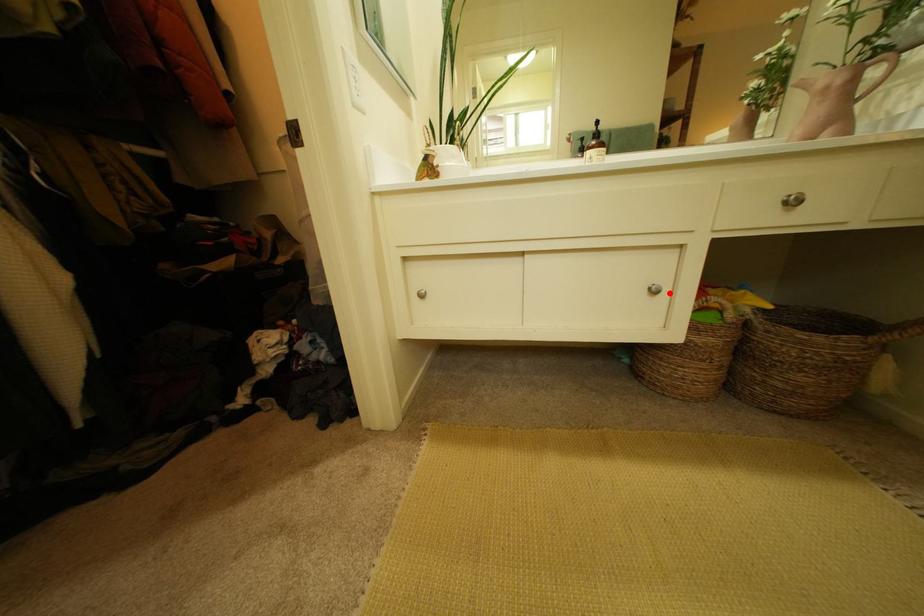
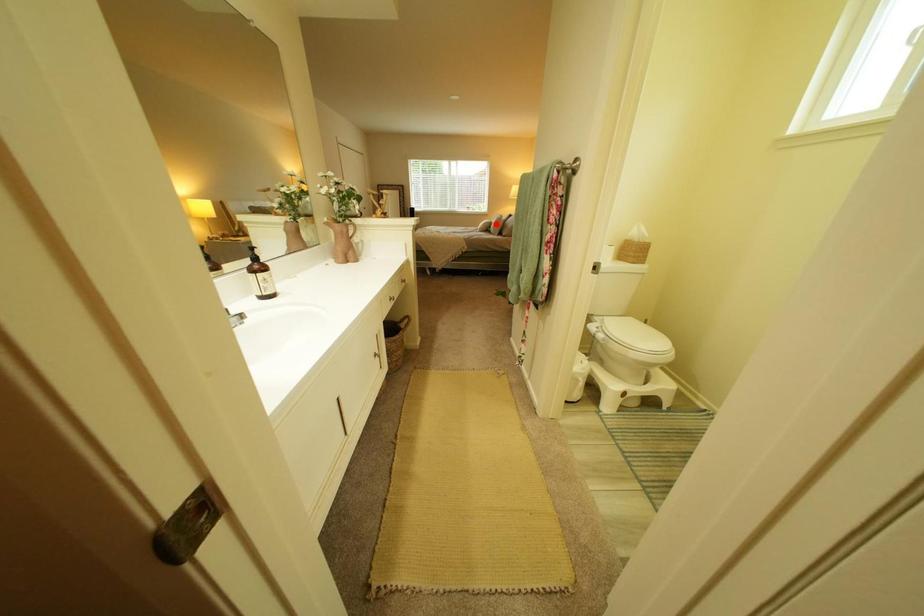
I am providing you with two images of the same scene from different viewpoints. A red point is marked on the first image and another point is marked on the second image. Does the point marked in image1 correspond to the same location as the one in image2?

No